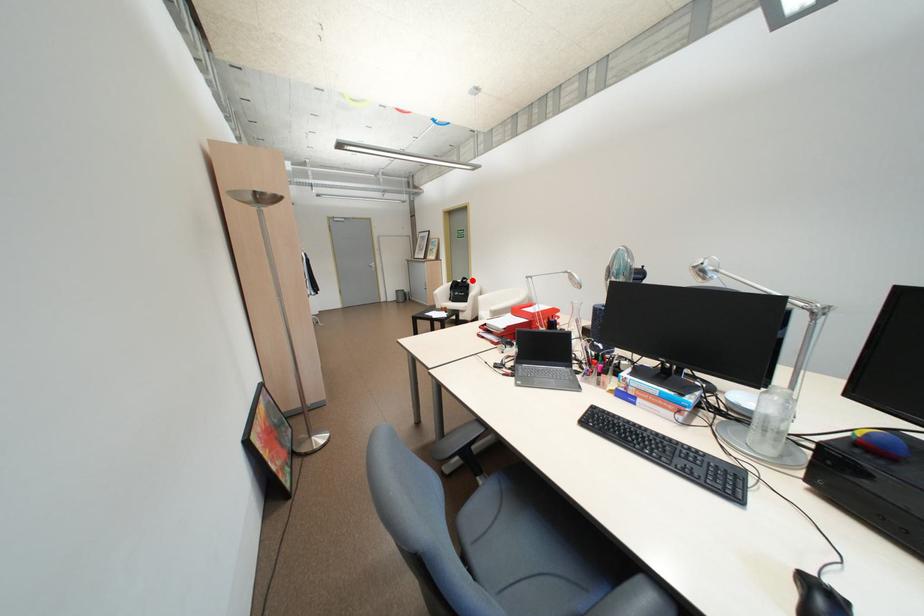
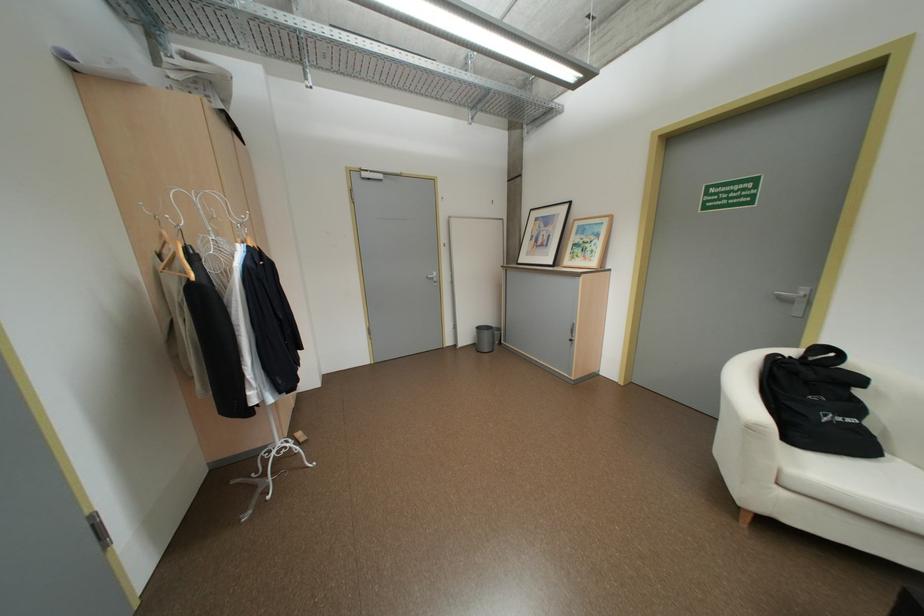
Question: A red point is marked in image1. In image2, is the corresponding 3D point closer to the camera or farther? Reply with the corresponding letter.

Choices:
 (A) The corresponding 3D point is closer.
 (B) The corresponding 3D point is farther.

Answer: (B)